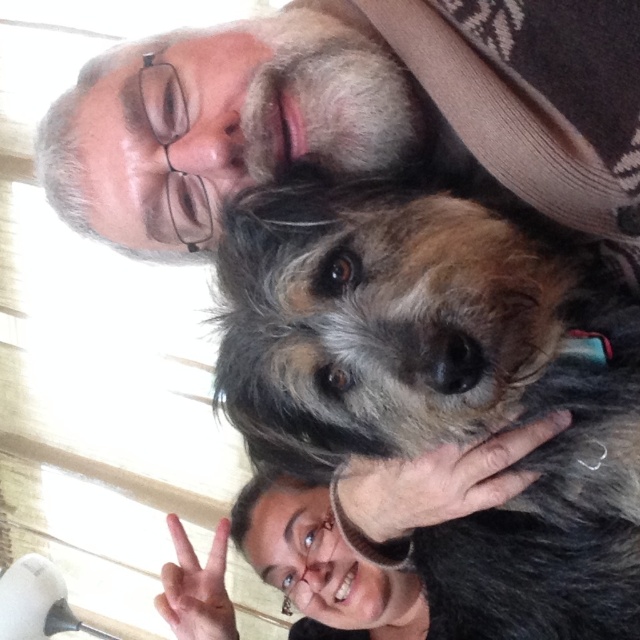
Question: Is the position of fuzzy brown dog at center more distant than that of gray beard at upper center?

Choices:
 (A) yes
 (B) no

Answer: (B)

Question: Is fuzzy brown dog at center thinner than gray beard at upper center?

Choices:
 (A) no
 (B) yes

Answer: (B)

Question: Which point is closer to the camera?

Choices:
 (A) (428, 49)
 (B) (518, 305)

Answer: (B)

Question: Can you confirm if fuzzy brown dog at center is positioned below gray beard at upper center?

Choices:
 (A) yes
 (B) no

Answer: (A)

Question: Which point is farther from the camera taking this photo?

Choices:
 (A) (266, 17)
 (B) (636, 584)

Answer: (A)

Question: Which of the following is the closest to the observer?

Choices:
 (A) gray beard at upper center
 (B) fuzzy brown dog at center

Answer: (B)